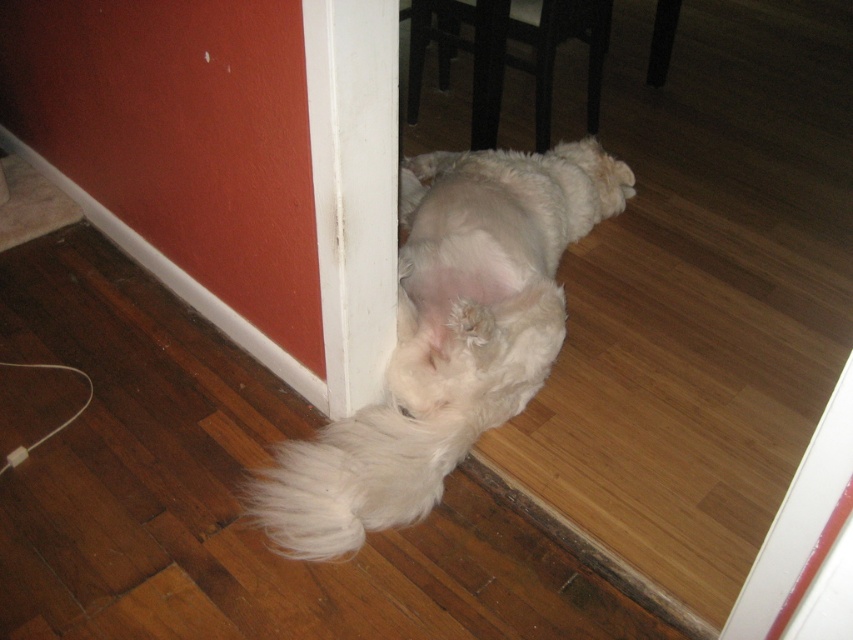
You are standing at the entrance of the room and see two points marked on the floor. The first point is at point (404, 220) and the second is at point (352, 488). Which point is closer to the entrance?

Point (352, 488) is closer to the entrance because it is in front of point (404, 220), which is behind it.

You are a pet owner who wants to place a small toy between the white fluffy cat at lower center and the white fluffy tail at lower center. Can you fit the toy between them?

The white fluffy cat at lower center is bigger than the white fluffy tail at lower center, so there might not be enough space to fit the toy between them.

Consider the image. You are standing in the room where the fluffy white dog is resting. You notice a point marked at coordinates [447,339]. What object is located at that point?

The point at coordinates [447,339] corresponds to the white fluffy cat at lower center.